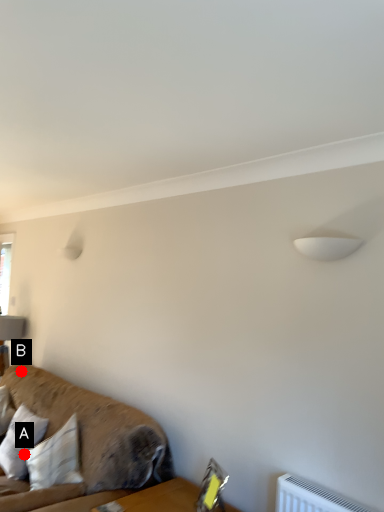
Question: Two points are circled on the image, labeled by A and B beside each circle. Among these points, which one is nearest to the camera?

Choices:
 (A) A is closer
 (B) B is closer

Answer: (A)